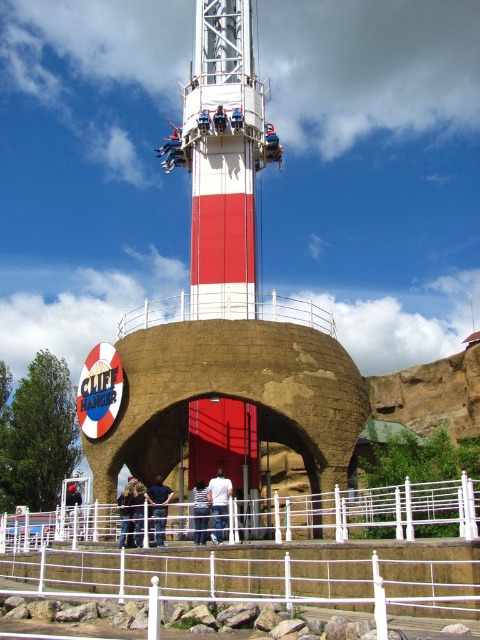
Question: Which of the following is the farthest from the observer?

Choices:
 (A) white shirt at center
 (B) brown fabric jacket at center

Answer: (B)

Question: In this image, where is red painted steel tower at center located relative to dark blue shirt at center?

Choices:
 (A) above
 (B) below

Answer: (A)

Question: Which of the following is the farthest from the observer?

Choices:
 (A) brown fabric jacket at center
 (B) dark blue shirt at center
 (C) white striped shirt at lower center

Answer: (C)

Question: Which of the following is the farthest from the observer?

Choices:
 (A) (222, 484)
 (B) (119, 337)
 (C) (132, 500)
 (D) (141, 488)

Answer: (D)

Question: Is red painted steel tower at center below blue fabric seat at center?

Choices:
 (A) yes
 (B) no

Answer: (A)

Question: Does white painted metal tower at center appear under white metal fence at lower center?

Choices:
 (A) no
 (B) yes

Answer: (A)